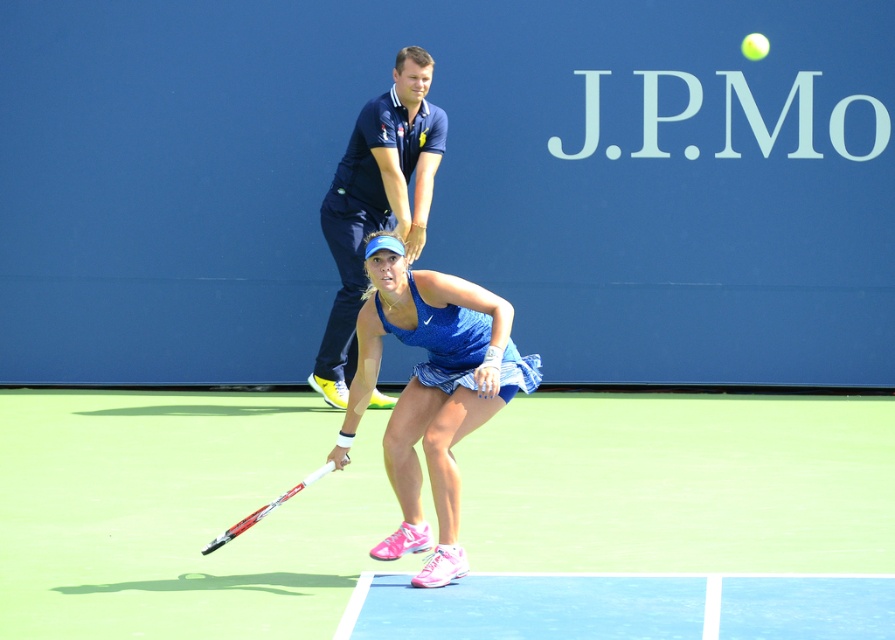
Question: Is green synthetic turf at center closer to camera compared to white matte tennis racket at center?

Choices:
 (A) no
 (B) yes

Answer: (B)

Question: Estimate the real-world distances between objects in this image. Which object is closer to the white matte tennis racket at center?

Choices:
 (A) green synthetic turf at center
 (B) dark blue uniform at upper center
 (C) blue fabric tennis skirt at center

Answer: (C)

Question: Does blue fabric tennis skirt at center appear on the left side of white matte tennis racket at center?

Choices:
 (A) yes
 (B) no

Answer: (B)

Question: Estimate the real-world distances between objects in this image. Which object is farther from the dark blue uniform at upper center?

Choices:
 (A) green synthetic turf at center
 (B) blue fabric tennis skirt at center

Answer: (B)

Question: Does dark blue uniform at upper center have a smaller size compared to white matte tennis racket at center?

Choices:
 (A) no
 (B) yes

Answer: (A)

Question: Which point is farther from the camera taking this photo?

Choices:
 (A) (313, 474)
 (B) (356, 179)
 (C) (431, 536)
 (D) (126, 620)

Answer: (B)